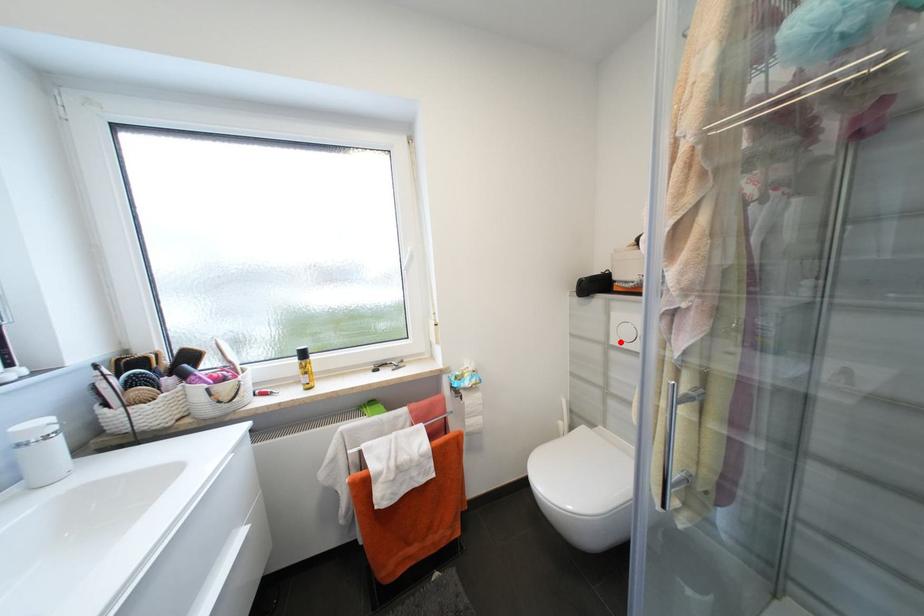
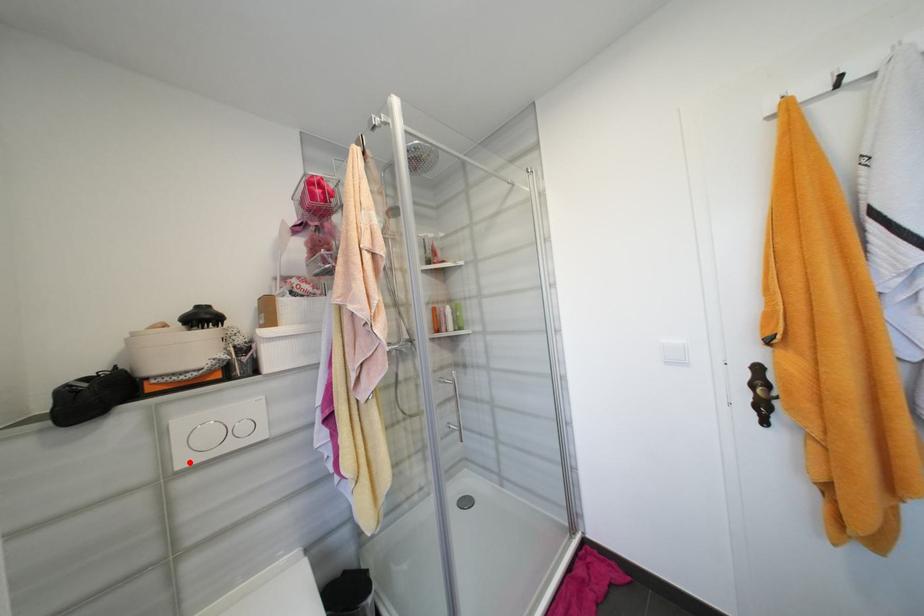
I am providing you with two images of the same scene from different viewpoints. A red point is marked on the first image and another point is marked on the second image. Is the marked point in image1 the same physical position as the marked point in image2?

Yes